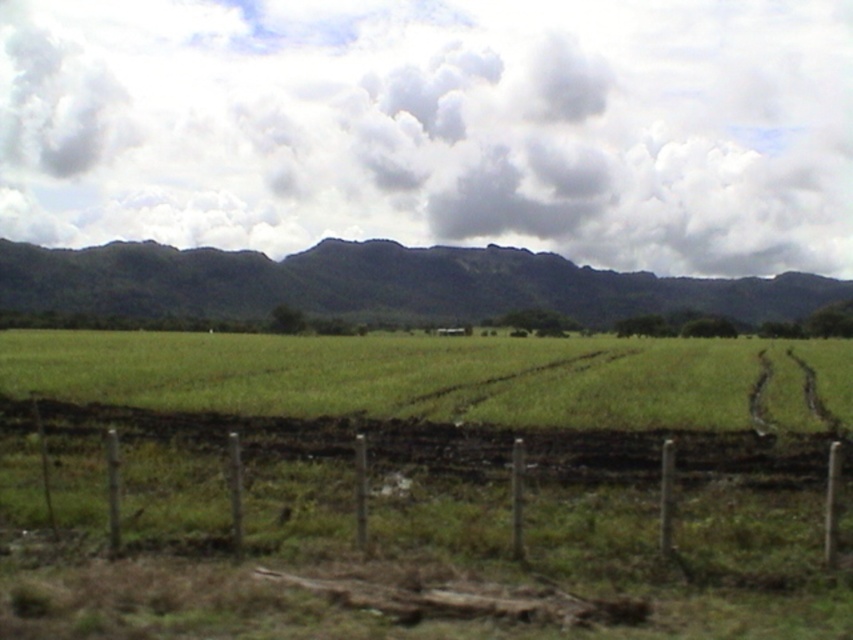
Which is more to the right, green grass at center or green leafy mountain at center?

Positioned to the right is green grass at center.

Measure the distance between point [392,337] and camera.

Point [392,337] is 122.51 meters from camera.

Which is behind, point (91, 358) or point (747, 294)?

The point (747, 294) is more distant.

In order to click on green grass at center in this screenshot , I will do `click(434, 376)`.

Which is more to the right, brown wire fence at lower center or green leafy mountain at center?

green leafy mountain at center is more to the right.

Looking at this image, measure the distance between point (x=595, y=484) and camera.

Point (x=595, y=484) is 14.35 meters from camera.

Where is `brown wire fence at lower center`? brown wire fence at lower center is located at coordinates (434, 492).

Does brown wire fence at lower center appear under green grass at center?

Actually, brown wire fence at lower center is above green grass at center.

Can you confirm if brown wire fence at lower center is wider than green grass at center?

No.

Locate an element on the screen. brown wire fence at lower center is located at coordinates (434, 492).

Find the location of a particular element. The width and height of the screenshot is (853, 640). brown wire fence at lower center is located at coordinates (434, 492).